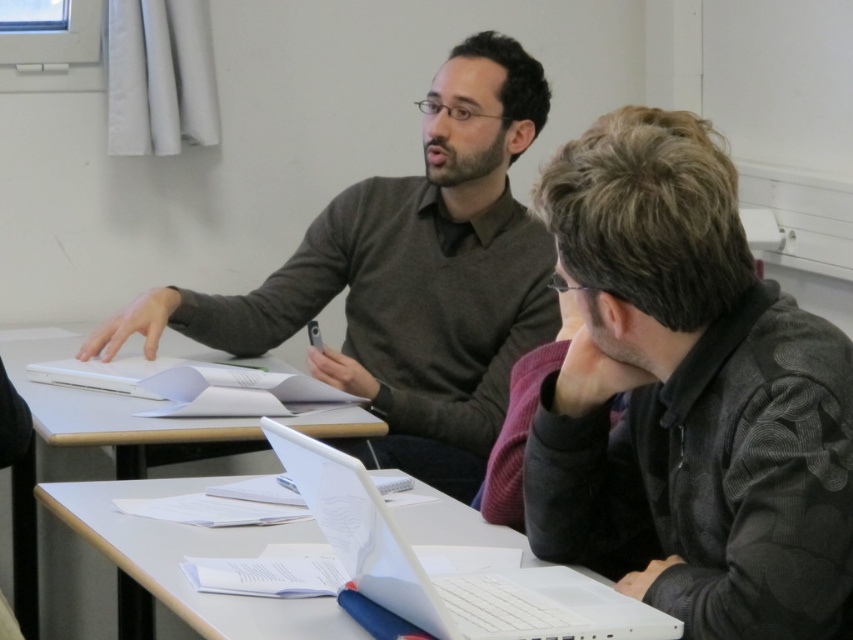
Question: Can you confirm if white plastic laptop at lower center is positioned above white plastic table at center?

Choices:
 (A) no
 (B) yes

Answer: (A)

Question: Can you confirm if dark gray sweater at center is positioned above white plastic table at center?

Choices:
 (A) yes
 (B) no

Answer: (A)

Question: Among these objects, which one is farthest from the camera?

Choices:
 (A) white plastic table at center
 (B) dark gray textured jacket at center

Answer: (A)

Question: Which of the following is the farthest from the observer?

Choices:
 (A) dark gray textured jacket at center
 (B) white plastic table at center
 (C) white plastic laptop at lower center
 (D) dark gray sweater at center

Answer: (D)

Question: Which of the following is the closest to the observer?

Choices:
 (A) (686, 376)
 (B) (259, 288)
 (C) (370, 586)
 (D) (141, 476)

Answer: (A)

Question: Is dark gray sweater at center further to the viewer compared to white plastic table at center?

Choices:
 (A) yes
 (B) no

Answer: (A)